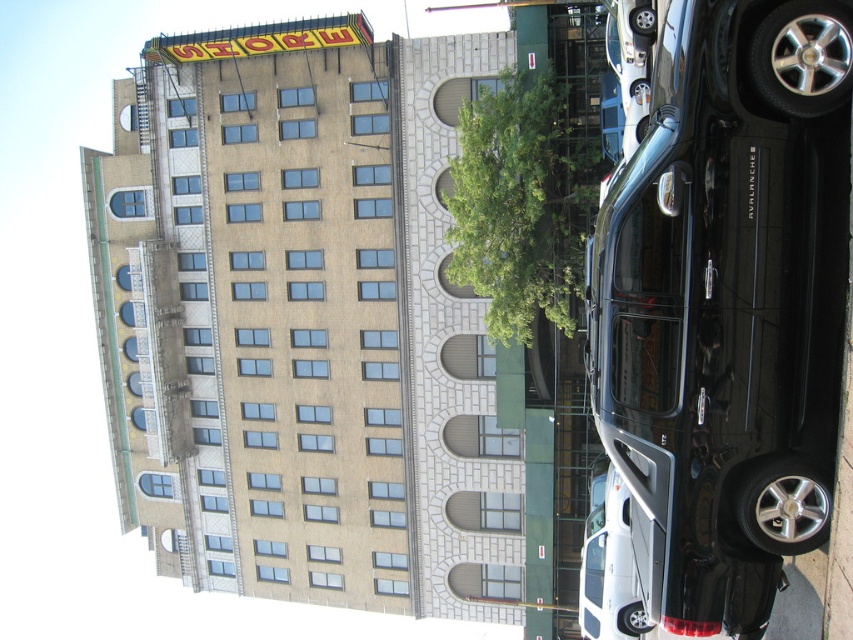
Does black glossy suv at right appear under green leafy tree at center?

Yes, black glossy suv at right is below green leafy tree at center.

Does point (801, 244) come closer to viewer compared to point (537, 99)?

Yes, point (801, 244) is in front of point (537, 99).

I want to click on black glossy suv at right, so click(724, 298).

I want to click on black glossy suv at right, so click(724, 298).